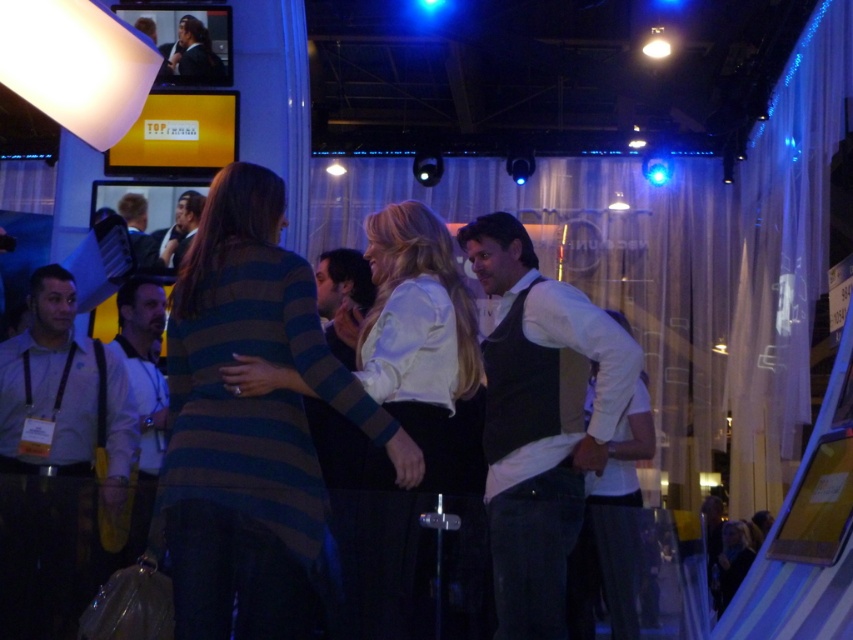
In the scene shown: Is the position of white matte shirt at center less distant than that of dark suit at center?

Yes, it is.

Who is taller, white matte shirt at center or dark suit at center?

Standing taller between the two is white matte shirt at center.

Who is more distant from viewer, (619, 620) or (175, 243)?

Point (175, 243)

Where is `white matte shirt at center`? white matte shirt at center is located at coordinates click(612, 531).

Which is in front, point (515, 298) or point (142, 300)?

Point (515, 298) is more forward.

Is matte black vest at center in front of light brown leather jacket at left?

Yes, matte black vest at center is closer to the viewer.

You are a GUI agent. You are given a task and a screenshot of the screen. Output one action in this format:
    pyautogui.click(x=<x>, y=<y>)
    Task: Click on the matte black vest at center
    The width and height of the screenshot is (853, 640).
    Given the screenshot: What is the action you would take?
    pyautogui.click(x=540, y=420)

You are a GUI agent. You are given a task and a screenshot of the screen. Output one action in this format:
    pyautogui.click(x=<x>, y=<y>)
    Task: Click on the matte black vest at center
    This screenshot has width=853, height=640.
    Given the screenshot: What is the action you would take?
    tap(540, 420)

Between point (239, 259) and point (560, 298), which one is positioned behind?

Positioned behind is point (560, 298).

Consider the image. Does striped sweater at center appear over matte black vest at center?

Indeed, striped sweater at center is positioned over matte black vest at center.

Identify the location of striped sweater at center. (252, 426).

At what (x,y) coordinates should I click in order to perform the action: click on striped sweater at center. Please return your answer as a coordinate pair (x, y). Image resolution: width=853 pixels, height=640 pixels. Looking at the image, I should click on (252, 426).